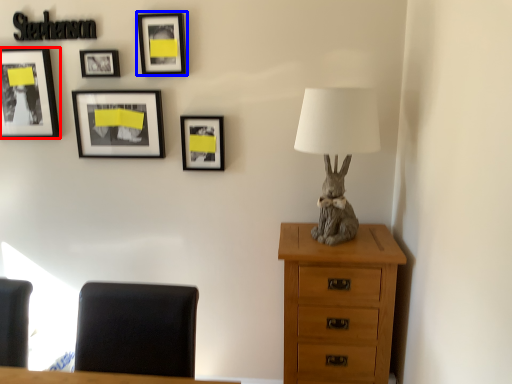
Question: Which of the following is the closest to the observer, picture frame (highlighted by a red box) or picture frame (highlighted by a blue box)?

Choices:
 (A) picture frame
 (B) picture frame

Answer: (B)